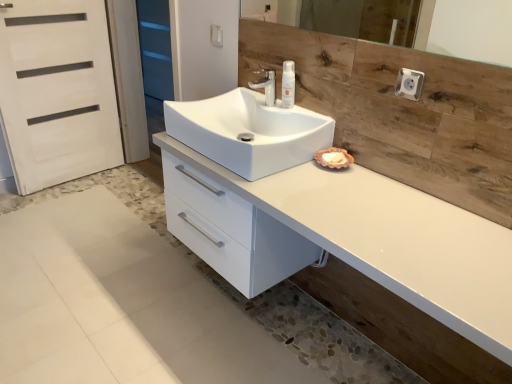
Question: Can you confirm if wooden mirror at upper center is positioned to the right of white glossy cabinet at center?

Choices:
 (A) no
 (B) yes

Answer: (B)

Question: Does wooden mirror at upper center come in front of white glossy cabinet at center?

Choices:
 (A) yes
 (B) no

Answer: (B)

Question: Would you say wooden mirror at upper center is a long distance from white glossy cabinet at center?

Choices:
 (A) yes
 (B) no

Answer: (A)

Question: From the image's perspective, is wooden mirror at upper center on top of white glossy cabinet at center?

Choices:
 (A) no
 (B) yes

Answer: (B)

Question: Considering the relative sizes of wooden mirror at upper center and white glossy cabinet at center in the image provided, is wooden mirror at upper center thinner than white glossy cabinet at center?

Choices:
 (A) yes
 (B) no

Answer: (A)

Question: Would you say blue matte screen door at upper left, acting as the 2th screen door starting from the front, is inside or outside white plastic socket at upper right?

Choices:
 (A) outside
 (B) inside

Answer: (A)

Question: From a real-world perspective, is blue matte screen door at upper left, acting as the 2th screen door starting from the front, physically located above or below white plastic socket at upper right?

Choices:
 (A) above
 (B) below

Answer: (B)

Question: Considering the relative positions of blue matte screen door at upper left, acting as the 2th screen door starting from the front, and white plastic socket at upper right in the image provided, is blue matte screen door at upper left, acting as the 2th screen door starting from the front, to the left or to the right of white plastic socket at upper right?

Choices:
 (A) right
 (B) left

Answer: (B)

Question: Looking at the image, does blue matte screen door at upper left, the 2th screen door when ordered from bottom to top, seem bigger or smaller compared to white plastic socket at upper right?

Choices:
 (A) small
 (B) big

Answer: (B)

Question: Is point [273, 71] positioned closer to the camera than point [102, 119]?

Choices:
 (A) closer
 (B) farther

Answer: (A)

Question: In terms of size, does matte silver faucet at center appear bigger or smaller than white matte door at left, marked as the 2th screen door in a top-to-bottom arrangement?

Choices:
 (A) small
 (B) big

Answer: (A)

Question: From a real-world perspective, is matte silver faucet at center above or below white matte door at left, the first screen door positioned from the bottom?

Choices:
 (A) below
 (B) above

Answer: (B)

Question: In the image, is matte silver faucet at center positioned in front of or behind white matte door at left, marked as the 2th screen door in a top-to-bottom arrangement?

Choices:
 (A) front
 (B) behind

Answer: (A)

Question: From a real-world perspective, is white plastic socket at upper right physically located above or below white glossy sink at center?

Choices:
 (A) below
 (B) above

Answer: (B)

Question: Does point (410, 77) appear closer or farther from the camera than point (239, 94)?

Choices:
 (A) farther
 (B) closer

Answer: (B)